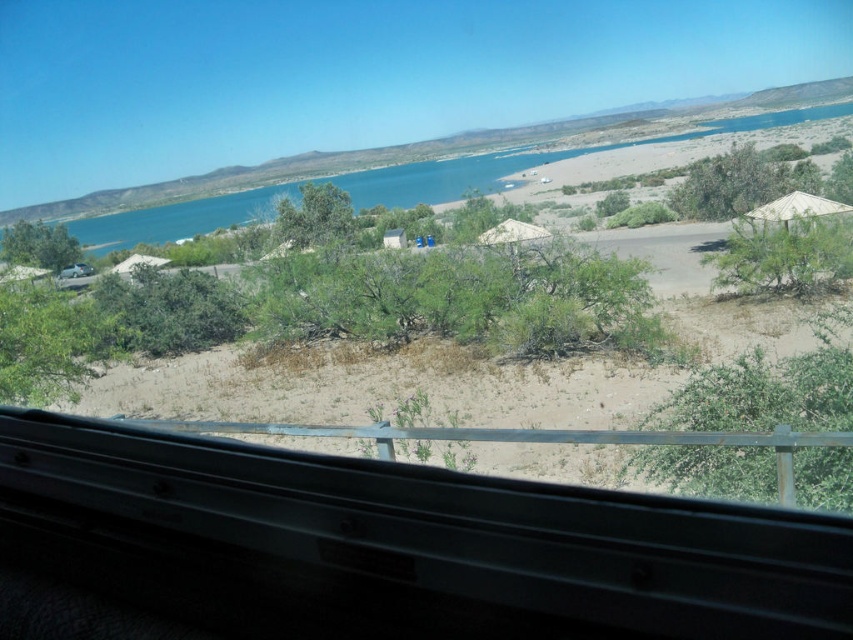
You are driving a car with a height of 1.8 meters and need to pass under a beige fabric umbrella at right. Can your car pass under it without hitting the umbrella?

The beige fabric umbrella at right is 31.29 meters from camera. Since the height of the car is 1.8 meters, the car can pass under the beige fabric umbrella at right without any issues as the distance is sufficient.

You are a passenger in a car and want to know if the green leafy bush at lower left is between you and the white matte hut at lower left. Based on the scene, can you confirm this?

Yes, the green leafy bush at lower left is closer to the viewer than the white matte hut at lower left, so it is between you and the white matte hut at lower left.